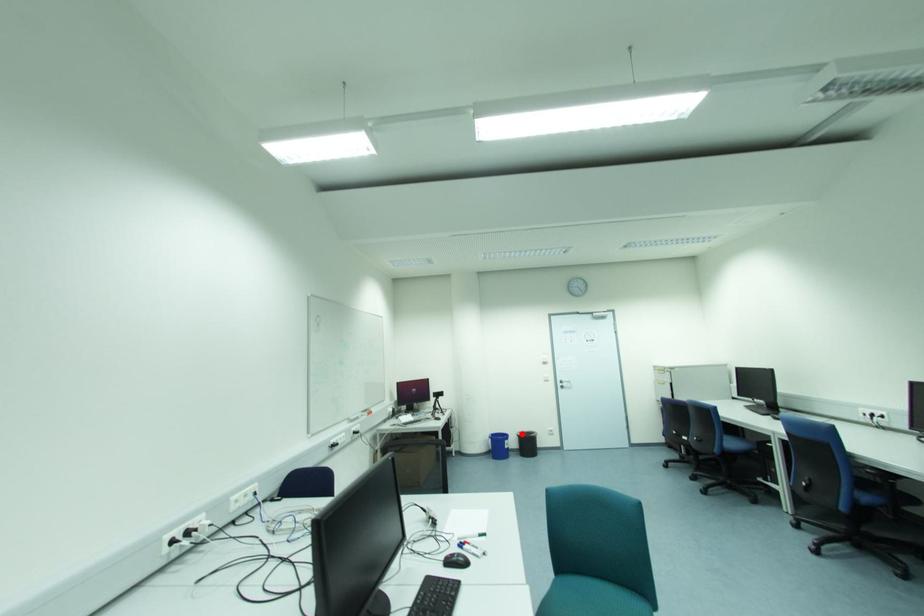
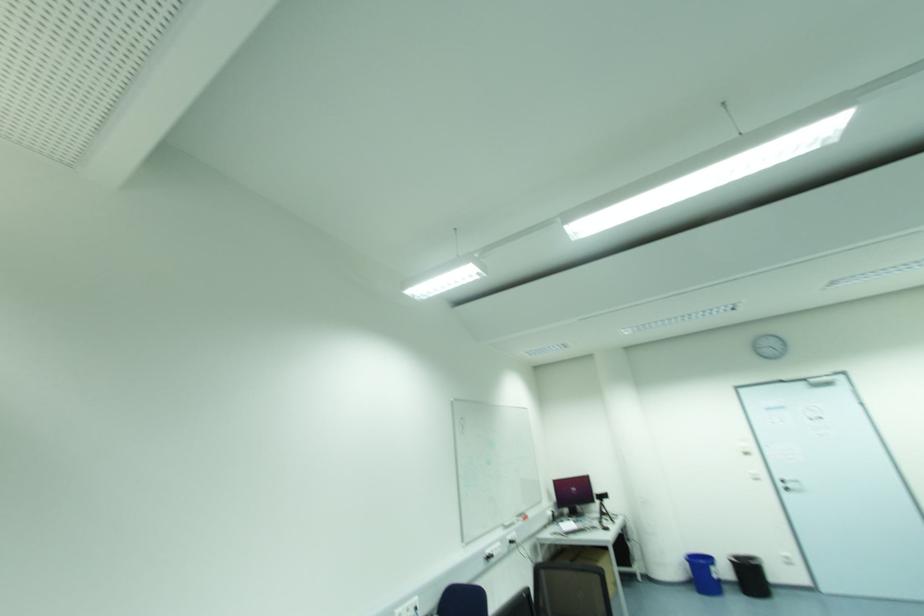
Locate, in the second image, the point that corresponds to the highlighted location in the first image.

(736, 559)